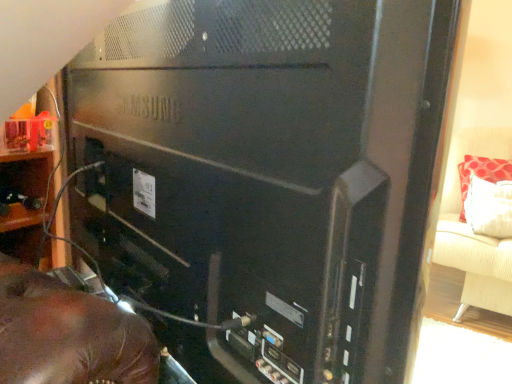
Question: Is wooden shelf at left wider or thinner than black matte computer tower at center?

Choices:
 (A) wide
 (B) thin

Answer: (A)

Question: From their relative heights in the image, would you say wooden shelf at left is taller or shorter than black matte computer tower at center?

Choices:
 (A) short
 (B) tall

Answer: (A)

Question: Estimate the real-world distances between objects in this image. Which object is closer to the black matte computer tower at center?

Choices:
 (A) red fabric pillow at right
 (B) beige fabric couch at right
 (C) wooden shelf at left

Answer: (C)

Question: Considering the real-world distances, which object is closest to the red fabric pillow at right?

Choices:
 (A) wooden shelf at left
 (B) beige fabric couch at right
 (C) black matte computer tower at center

Answer: (B)